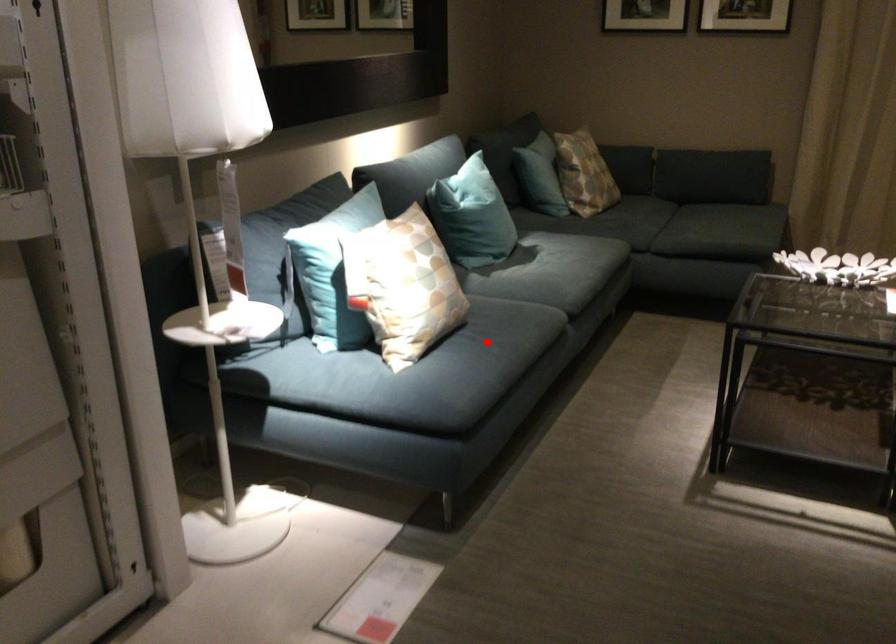
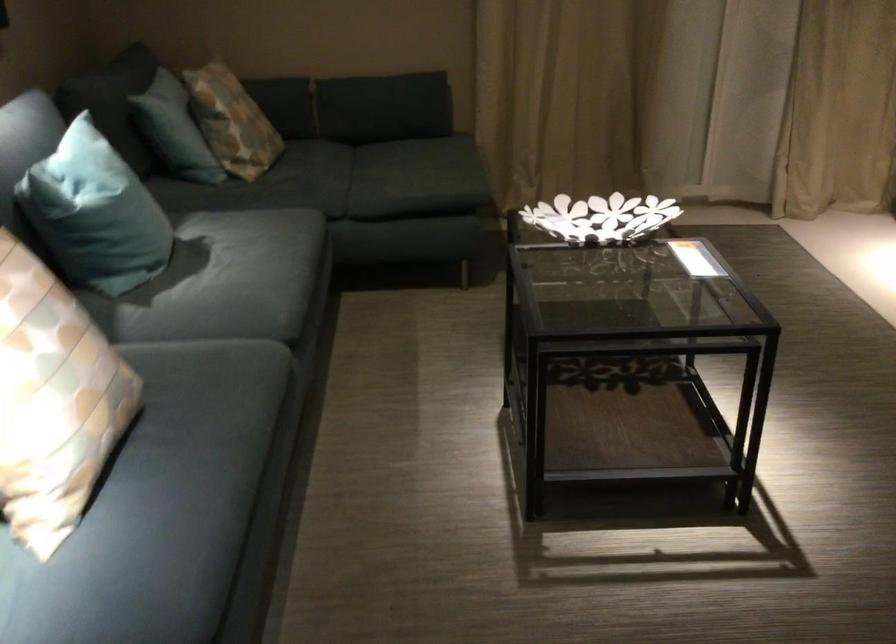
In the second image, find the point that corresponds to the highlighted location in the first image.

(197, 436)